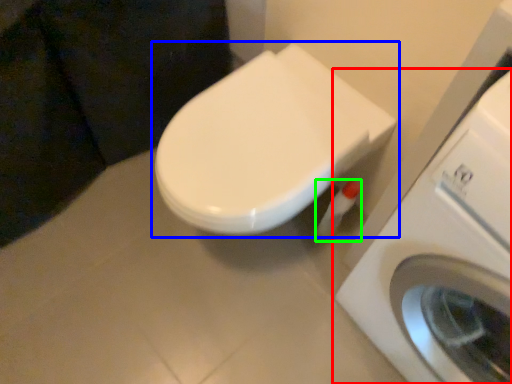
Question: Based on their relative distances, which object is nearer to washing machine (highlighted by a red box)? Choose from toilet (highlighted by a blue box) and toilet paper (highlighted by a green box).

Choices:
 (A) toilet
 (B) toilet paper

Answer: (A)